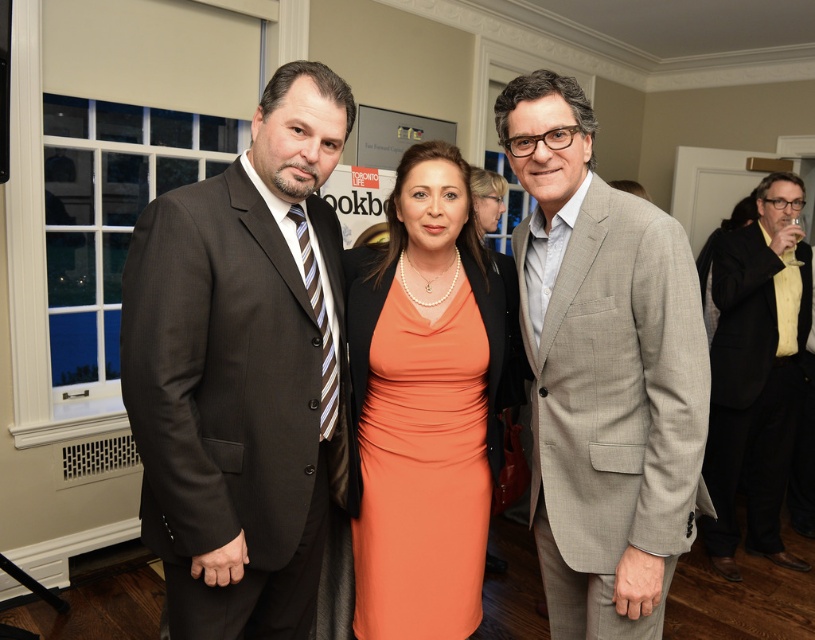
Question: Observing the image, what is the correct spatial positioning of dark brown suit at left in reference to orange satin dress at center?

Choices:
 (A) right
 (B) left

Answer: (B)

Question: Does orange satin dress at center have a smaller size compared to black textured suit at right?

Choices:
 (A) no
 (B) yes

Answer: (B)

Question: Among these objects, which one is farthest from the camera?

Choices:
 (A) dark brown suit at left
 (B) orange satin dress at center
 (C) black textured suit at right

Answer: (C)

Question: Which of the following is the closest to the observer?

Choices:
 (A) orange satin dress at center
 (B) gray textured suit at center

Answer: (B)

Question: Which point appears farthest from the camera in this image?

Choices:
 (A) (313, 346)
 (B) (377, 508)
 (C) (743, 330)

Answer: (C)

Question: Can you confirm if dark brown suit at left is smaller than black textured suit at right?

Choices:
 (A) no
 (B) yes

Answer: (B)